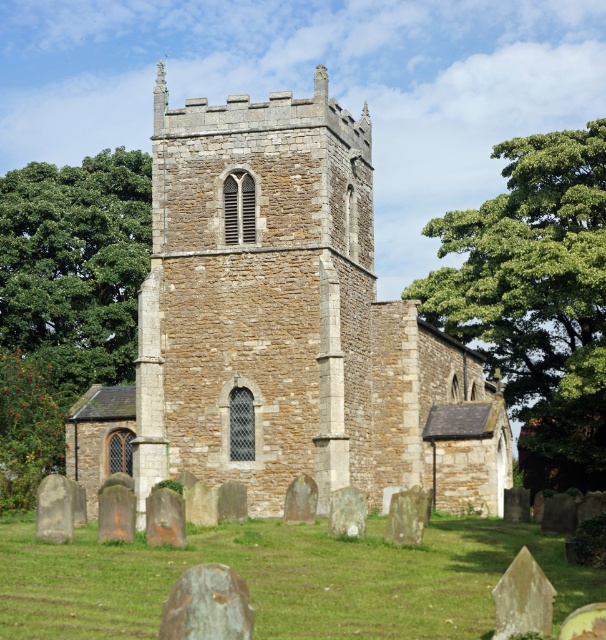
From the picture: You are standing in a field looking at the brown stone church at center and the green leafy tree at left. Which object is closer to the left side of the image?

The green leafy tree at left is closer to the left side of the image because the brown stone church at center is positioned to its right.

You are a tourist visiting the church and want to take a photo that includes both the brown stone church at center and the green leafy tree at left. Based on their sizes, which one should you focus on to ensure both fit in the frame?

The brown stone church at center is bigger than the green leafy tree at left, so you should focus on the brown stone church at center to ensure both fit in the frame.